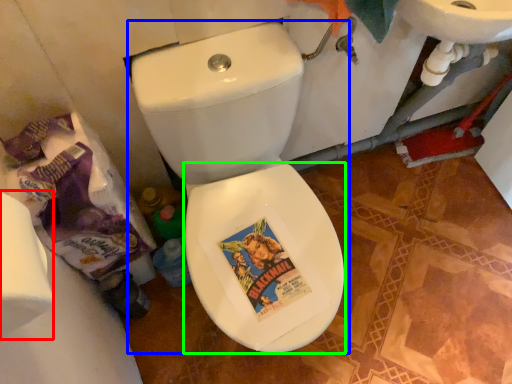
Question: Which is farther away from toilet paper (highlighted by a red box)? toilet (highlighted by a blue box) or bidet (highlighted by a green box)?

Choices:
 (A) toilet
 (B) bidet

Answer: (B)